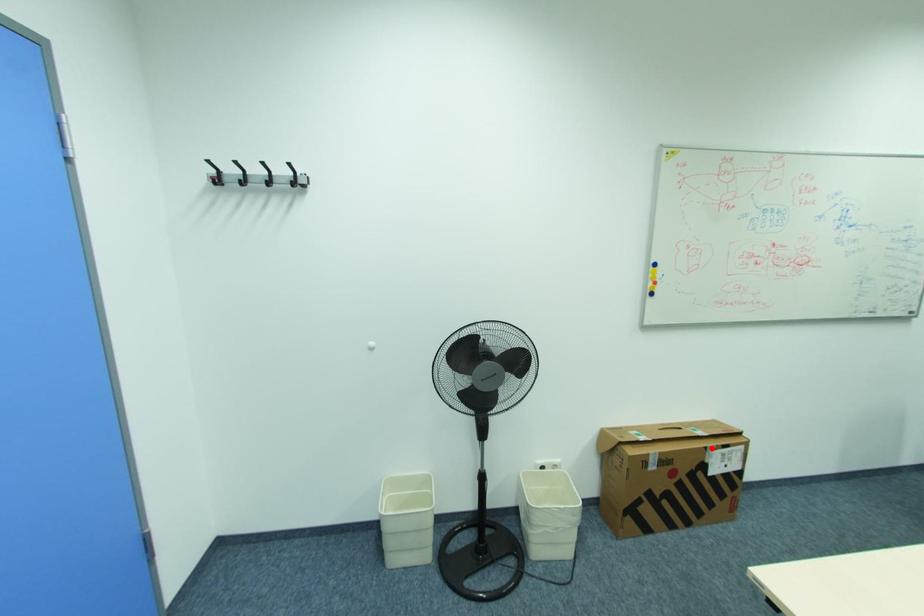
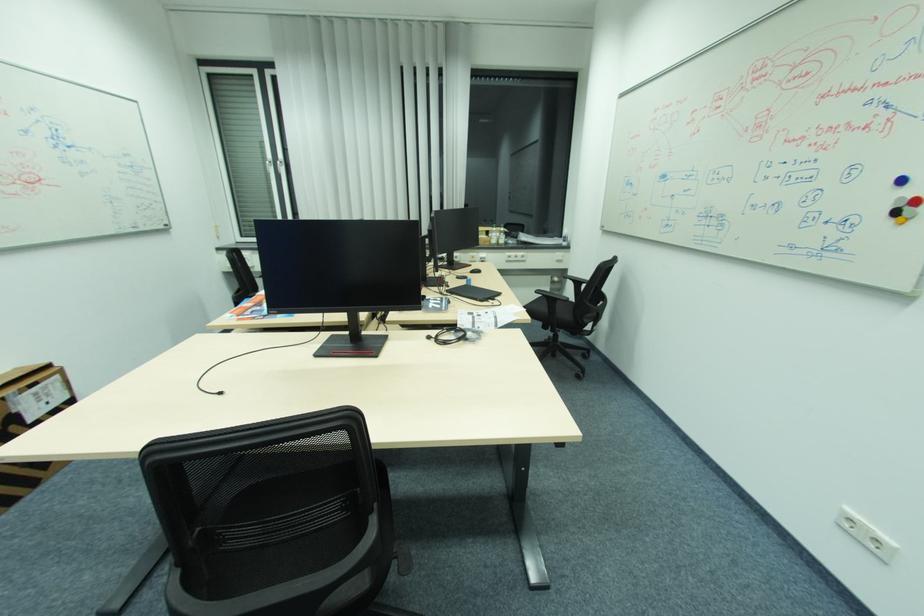
Locate, in the second image, the point that corresponds to the highlighted location in the first image.

(7, 399)